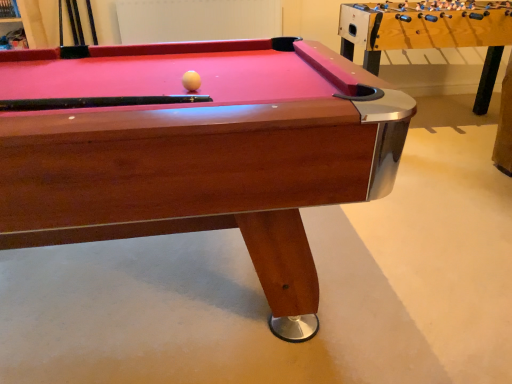
Question: From a real-world perspective, is wooden foosball table at right positioned under wooden billiard table at center based on gravity?

Choices:
 (A) no
 (B) yes

Answer: (A)

Question: Is wooden foosball table at right positioned behind wooden billiard table at center?

Choices:
 (A) no
 (B) yes

Answer: (B)

Question: Is wooden foosball table at right wider than wooden billiard table at center?

Choices:
 (A) yes
 (B) no

Answer: (A)

Question: Is wooden foosball table at right outside wooden billiard table at center?

Choices:
 (A) yes
 (B) no

Answer: (A)

Question: Does wooden foosball table at right lie in front of wooden billiard table at center?

Choices:
 (A) no
 (B) yes

Answer: (A)

Question: Is wooden foosball table at right thinner than wooden billiard table at center?

Choices:
 (A) yes
 (B) no

Answer: (B)

Question: Could you tell me if white matte ball at center is facing wooden billiard table at center?

Choices:
 (A) no
 (B) yes

Answer: (B)

Question: Is white matte ball at center in front of wooden billiard table at center?

Choices:
 (A) yes
 (B) no

Answer: (B)

Question: Are white matte ball at center and wooden billiard table at center beside each other?

Choices:
 (A) yes
 (B) no

Answer: (B)

Question: Does white matte ball at center have a greater height compared to wooden billiard table at center?

Choices:
 (A) yes
 (B) no

Answer: (B)

Question: From the image's perspective, would you say white matte ball at center is shown under wooden billiard table at center?

Choices:
 (A) yes
 (B) no

Answer: (B)

Question: From a real-world perspective, is white matte ball at center on top of wooden billiard table at center?

Choices:
 (A) yes
 (B) no

Answer: (A)

Question: From the image's perspective, is wooden foosball table at right located above white matte ball at center?

Choices:
 (A) no
 (B) yes

Answer: (B)